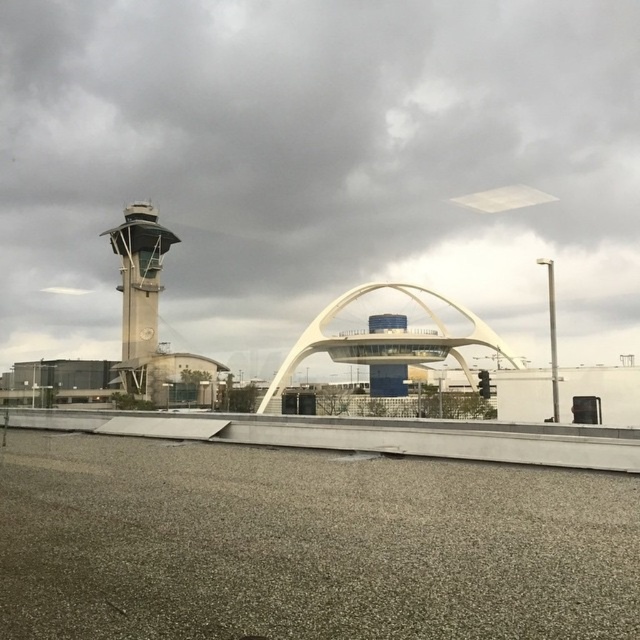
How distant is white matte arch at center from concrete control tower at left?

white matte arch at center is 68.79 meters from concrete control tower at left.

Is point (204, 29) more distant than point (163, 244)?

Yes, point (204, 29) is farther from viewer.

The image size is (640, 640). Identify the location of white matte arch at center. (317, 164).

Is point (538, 612) farther from viewer compared to point (506, 353)?

No, (538, 612) is in front of (506, 353).

Can you confirm if gray asphalt tarmac at lower center is positioned above white smooth arch at center?

Correct, gray asphalt tarmac at lower center is located above white smooth arch at center.

Which is in front, point (147, 547) or point (388, 333)?

Point (147, 547)

This screenshot has height=640, width=640. Identify the location of gray asphalt tarmac at lower center. (307, 545).

Is white matte arch at center below white smooth arch at center?

Actually, white matte arch at center is above white smooth arch at center.

Which is more to the right, white matte arch at center or white smooth arch at center?

white smooth arch at center is more to the right.

Which is in front, point (211, 120) or point (369, 284)?

Point (369, 284)

Find the location of `white matte arch at center`. white matte arch at center is located at coordinates (317, 164).